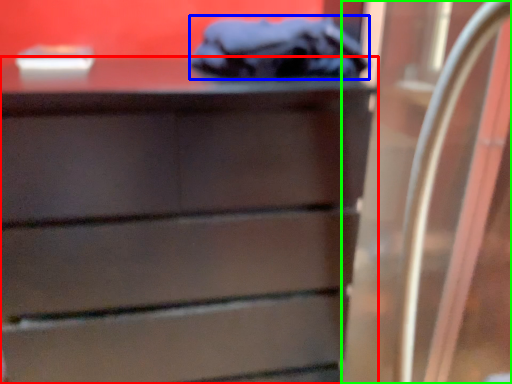
Question: Considering the real-world distances, which object is closest to chest of drawers (highlighted by a red box)? scrub (highlighted by a blue box) or glass door (highlighted by a green box).

Choices:
 (A) scrub
 (B) glass door

Answer: (A)